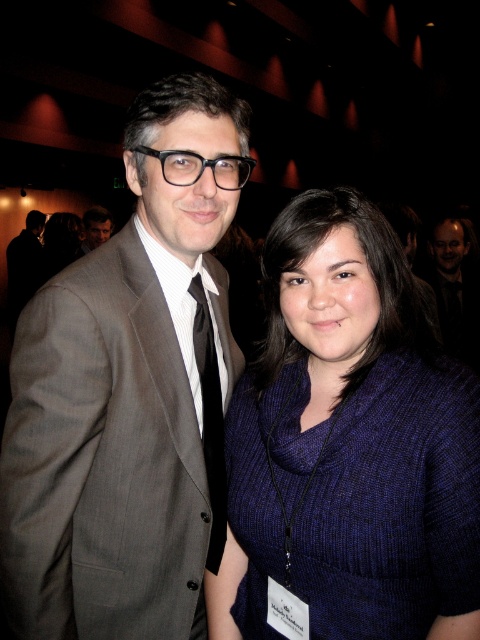
Based on the photo, is black satin tie at center positioned in front of matte black suit at left?

Yes, black satin tie at center is in front of matte black suit at left.

Is black satin tie at center to the left of matte black suit at left from the viewer's perspective?

Incorrect, black satin tie at center is not on the left side of matte black suit at left.

Between point (212, 454) and point (111, 230), which one is positioned behind?

Positioned behind is point (111, 230).

The image size is (480, 640). I want to click on black satin tie at center, so click(x=210, y=420).

Is dark gray suit at center bigger than black satin tie at center?

Yes, dark gray suit at center is bigger than black satin tie at center.

Is point (456, 320) positioned in front of point (207, 456)?

That is False.

This screenshot has width=480, height=640. What are the coordinates of `dark gray suit at center` in the screenshot? It's located at (455, 288).

Measure the distance between matte gray suit at center and camera.

91.09 centimeters

Can you confirm if matte gray suit at center is wider than black satin tie at center?

Correct, the width of matte gray suit at center exceeds that of black satin tie at center.

Locate an element on the screen. matte gray suit at center is located at coordinates (130, 394).

What are the coordinates of `matte gray suit at center` in the screenshot? It's located at (130, 394).